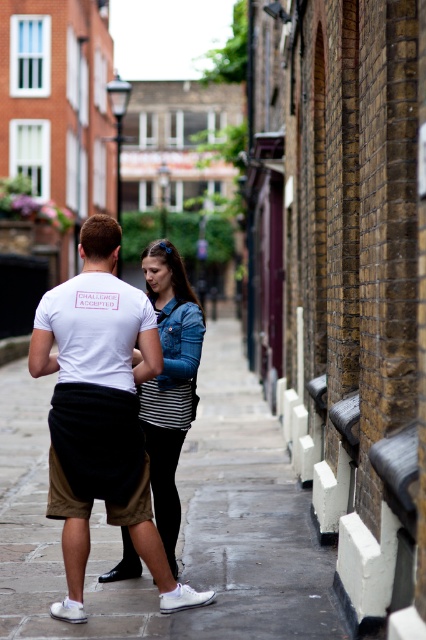
Question: Which point is farther to the camera?

Choices:
 (A) white cotton t-shirt at center
 (B) denim jacket at center

Answer: (B)

Question: Can you confirm if white cotton t-shirt at center is thinner than denim jacket at center?

Choices:
 (A) yes
 (B) no

Answer: (B)

Question: Can you confirm if white cotton t-shirt at center is wider than denim jacket at center?

Choices:
 (A) yes
 (B) no

Answer: (A)

Question: Among these objects, which one is nearest to the camera?

Choices:
 (A) smooth concrete pavement at center
 (B) denim jacket at center

Answer: (A)

Question: Which of the following is the farthest from the observer?

Choices:
 (A) white cotton t-shirt at center
 (B) smooth concrete pavement at center

Answer: (A)

Question: Observing the image, what is the correct spatial positioning of smooth concrete pavement at center in reference to denim jacket at center?

Choices:
 (A) above
 (B) below

Answer: (B)